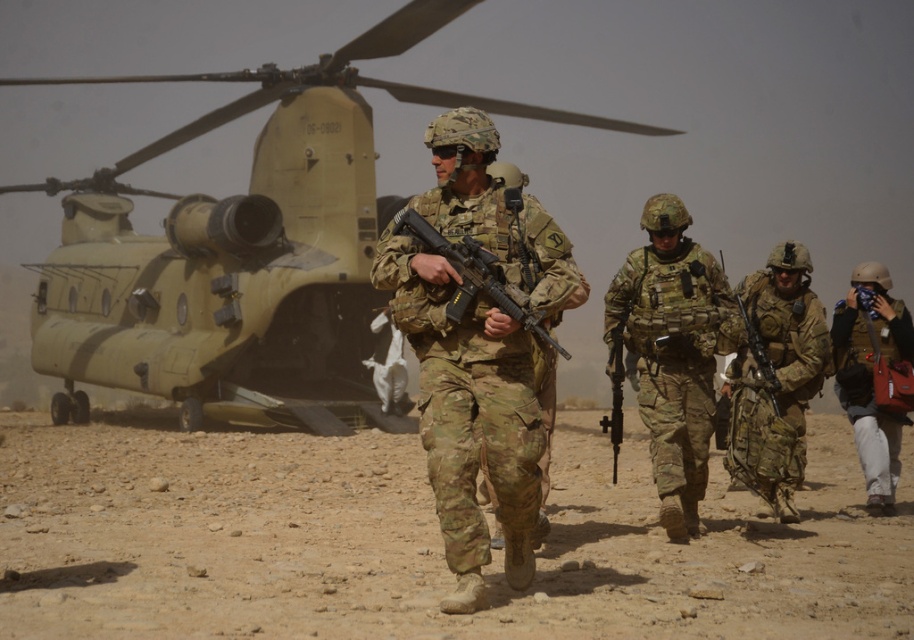
Question: Which point is closer to the camera?

Choices:
 (A) (457, 186)
 (B) (796, 368)
 (C) (556, 346)

Answer: (C)

Question: Where is camouflage uniform at center located in relation to brown fabric backpack at lower right in the image?

Choices:
 (A) right
 (B) left

Answer: (B)

Question: Does camouflage paint helicopter at center appear on the left side of camouflage uniform at center?

Choices:
 (A) yes
 (B) no

Answer: (A)

Question: Which is farther from the camouflage paint helicopter at center?

Choices:
 (A) camouflage fabric uniform at center
 (B) camouflage fabric rifle at center

Answer: (A)

Question: From the image, what is the correct spatial relationship of dusty brown terrain at center in relation to camouflage paint helicopter at center?

Choices:
 (A) left
 (B) right

Answer: (B)

Question: Estimate the real-world distances between objects in this image. Which object is closer to the camouflage fabric rifle at center?

Choices:
 (A) matte black rifle at center
 (B) camouflage paint helicopter at center

Answer: (A)